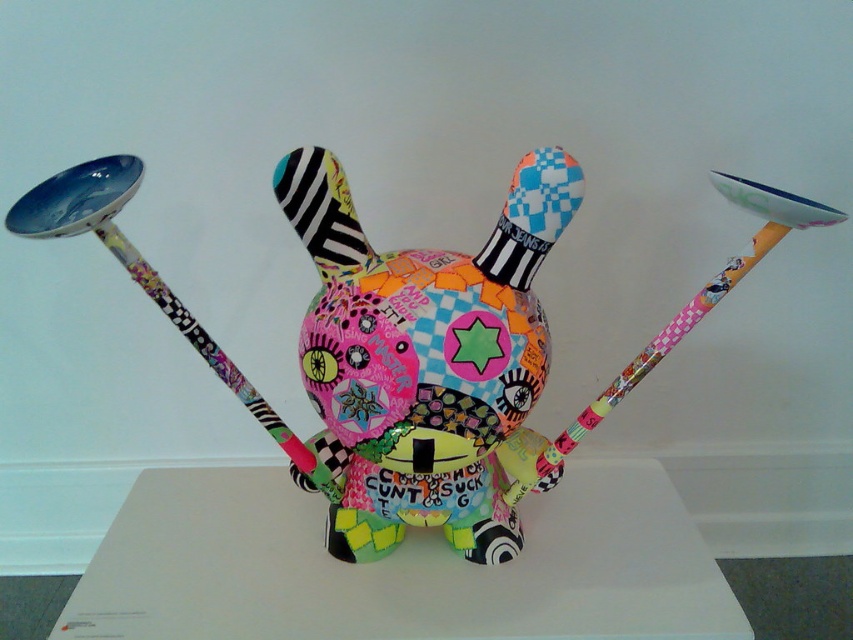
Which is in front, point (518, 532) or point (302, 163)?

Point (302, 163) is in front.

What do you see at coordinates (413, 344) in the screenshot? I see `multicolored fabric toy at center` at bounding box center [413, 344].

Find the location of `multicolored fabric toy at center`. multicolored fabric toy at center is located at coordinates (413, 344).